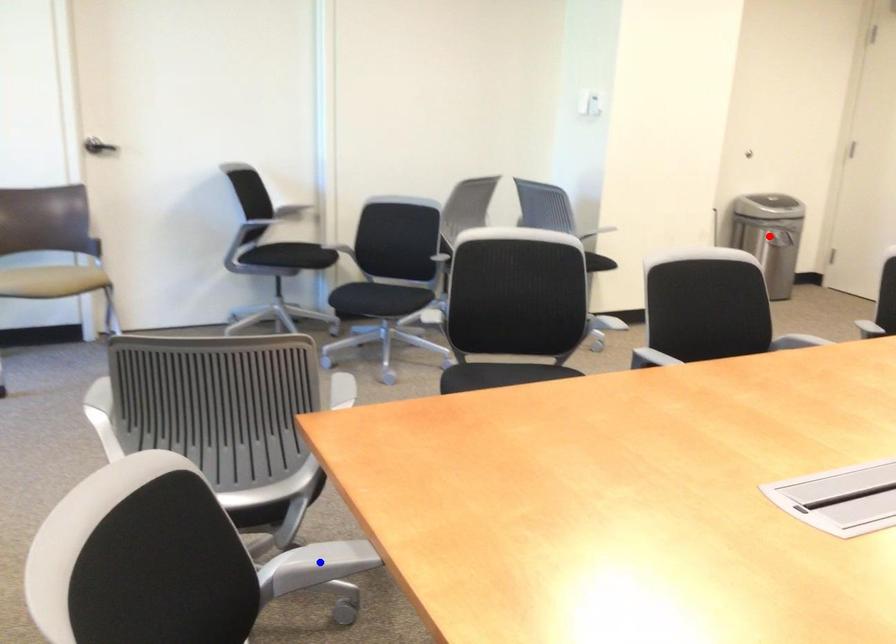
Question: Two points are marked on the image. Which point is closer to the camera?

Choices:
 (A) Blue point is closer.
 (B) Red point is closer.

Answer: (A)